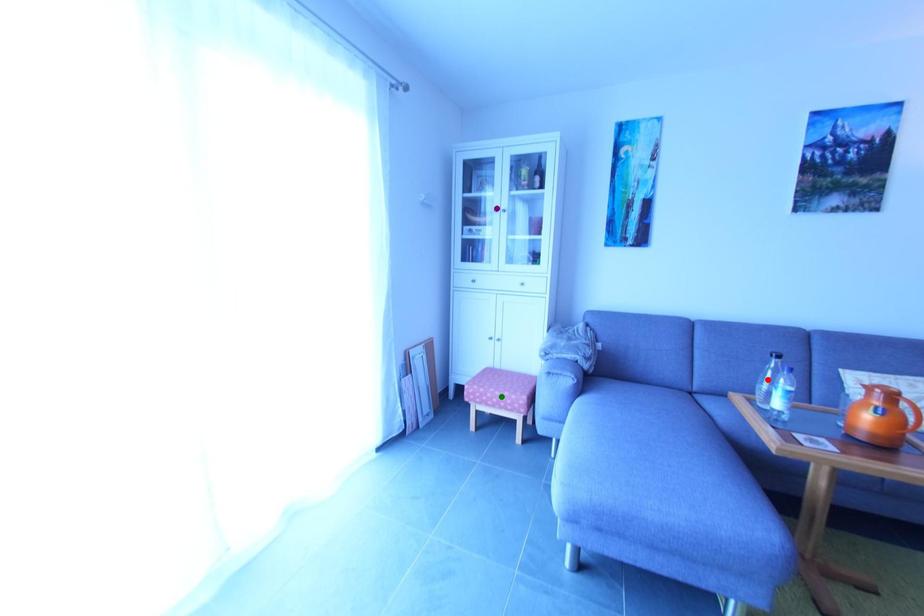
Order these from nearest to farthest:
purple point | red point | green point

purple point → green point → red point